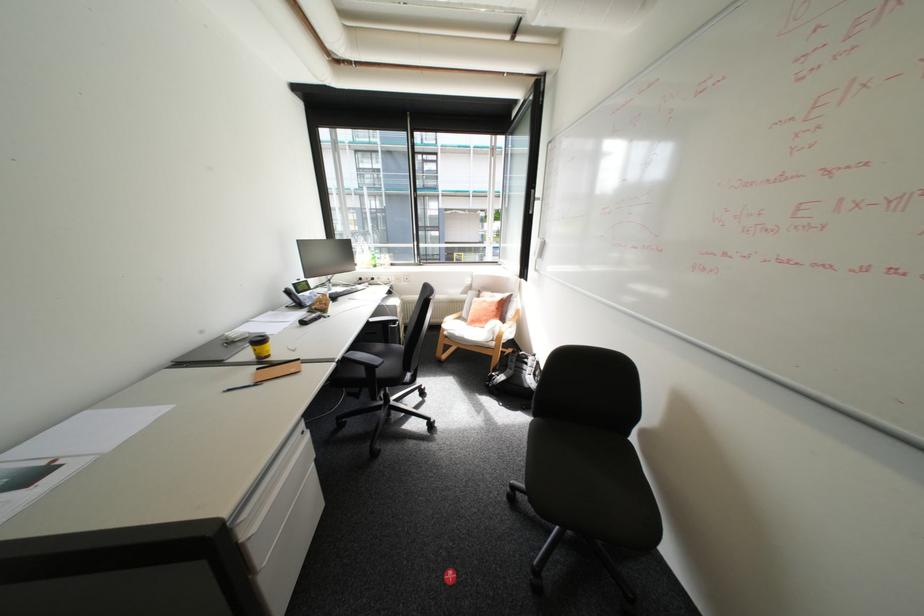
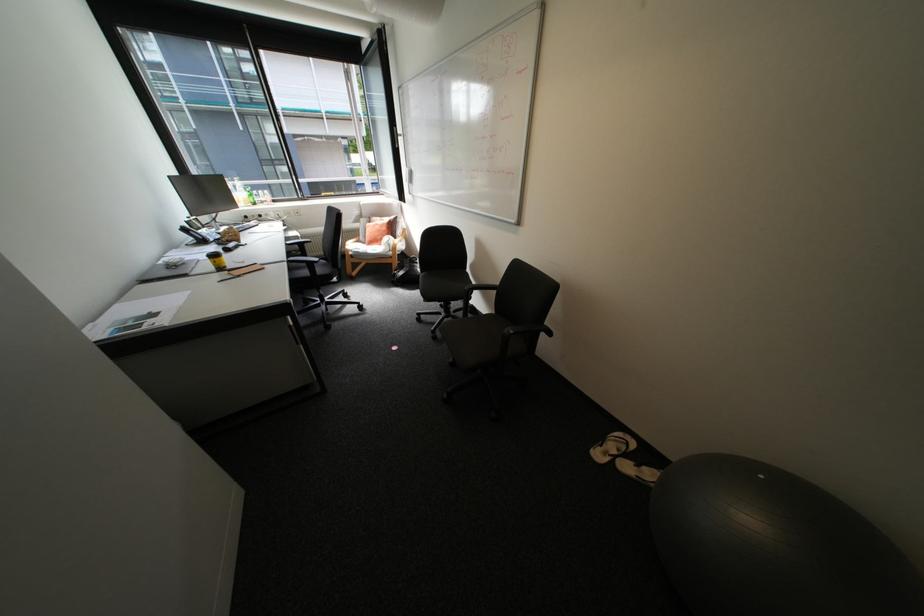
Locate, in the second image, the point that corresponds to [378,265] in the first image.

(256, 204)